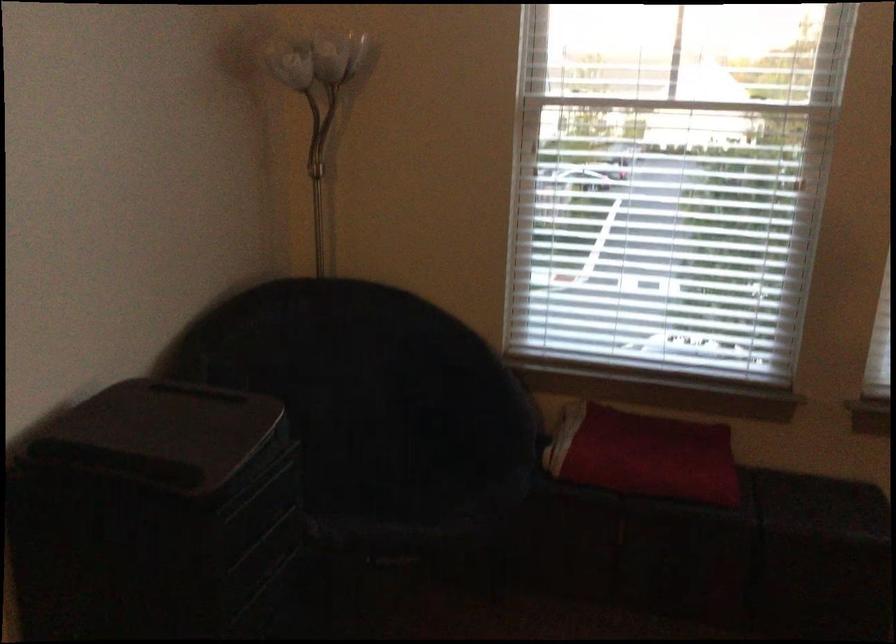
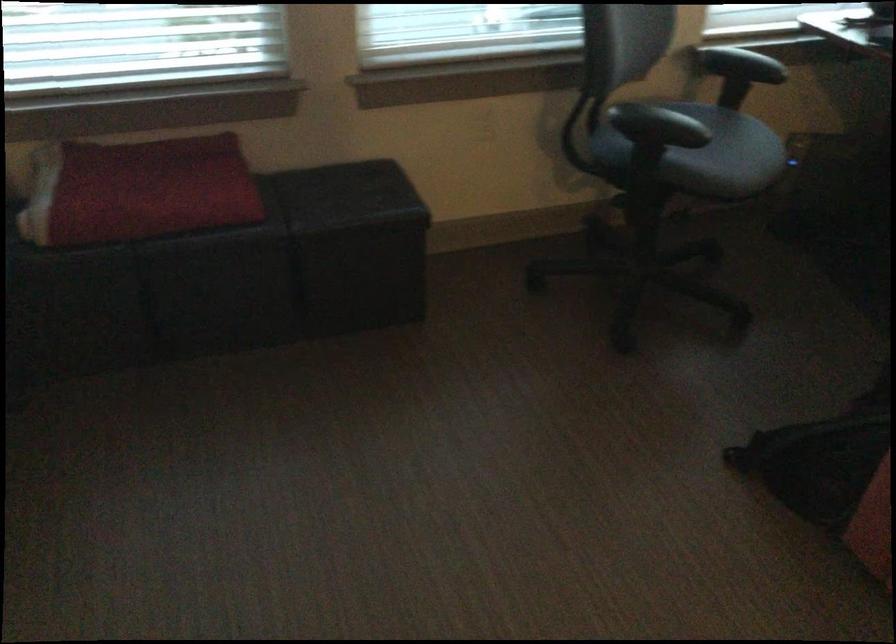
Based on the continuous images, in which direction is the camera rotating?

The camera's rotation is toward right-down.